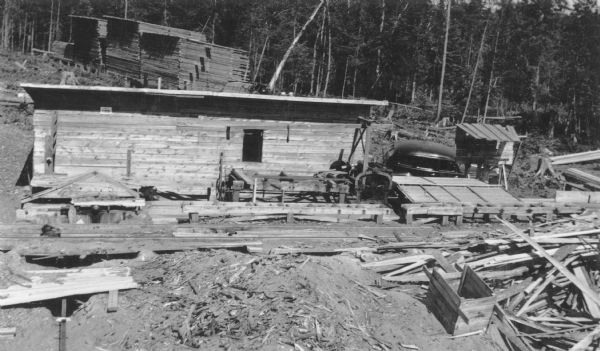
Locate an element on the screen. window is located at coordinates (248, 143).